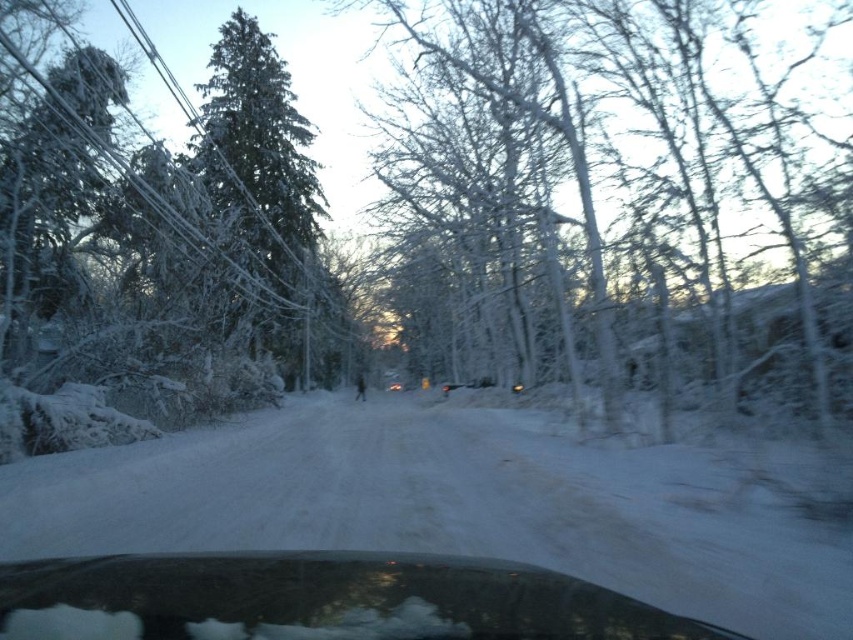
In the scene shown: Which is above, white frosty tree at center or green frosted evergreen at left?

Positioned higher is white frosty tree at center.

Can you confirm if white frosty tree at center is thinner than green frosted evergreen at left?

No, white frosty tree at center is not thinner than green frosted evergreen at left.

Who is more forward, (386, 196) or (215, 186)?

Point (215, 186) is in front.

Image resolution: width=853 pixels, height=640 pixels. I want to click on white frosty tree at center, so click(614, 148).

Between white frosty tree at center and transparent glass car window at lower center, which one has more height?

white frosty tree at center

Looking at this image, does white frosty tree at center have a greater width compared to transparent glass car window at lower center?

Indeed, white frosty tree at center has a greater width compared to transparent glass car window at lower center.

Between point (621, 1) and point (469, 621), which one is positioned in front?

Point (469, 621) is in front.

At what (x,y) coordinates should I click in order to perform the action: click on white frosty tree at center. Please return your answer as a coordinate pair (x, y). Image resolution: width=853 pixels, height=640 pixels. Looking at the image, I should click on (614, 148).

Between white fluffy snow at center and transparent glass car window at lower center, which one is positioned lower?

white fluffy snow at center is lower down.

Which of these two, white fluffy snow at center or transparent glass car window at lower center, stands taller?

white fluffy snow at center is taller.

This screenshot has height=640, width=853. Describe the element at coordinates (445, 504) in the screenshot. I see `white fluffy snow at center` at that location.

In order to click on white fluffy snow at center in this screenshot , I will do `click(445, 504)`.